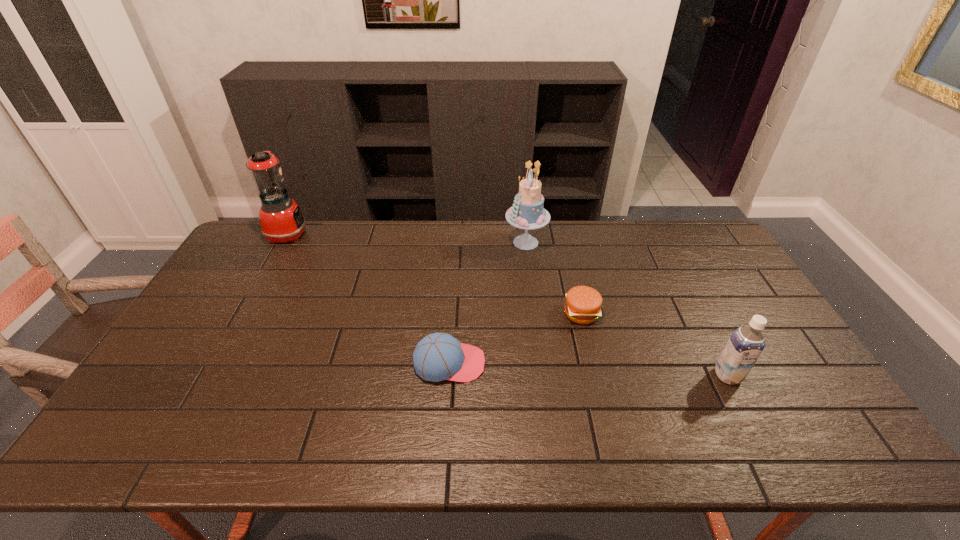
The height and width of the screenshot is (540, 960). Find the location of `blank space located with a ladder on the side of the cake`. blank space located with a ladder on the side of the cake is located at coordinates (401, 242).

Where is `free region located 0.150m with a ladder on the side of the cake`? free region located 0.150m with a ladder on the side of the cake is located at coordinates (463, 242).

You are a GUI agent. You are given a task and a screenshot of the screen. Output one action in this format:
    pyautogui.click(x=<x>, y=<y>)
    Task: Click on the blank space located 0.050m on the label of the soya milk
    
    Given the screenshot: What is the action you would take?
    pyautogui.click(x=742, y=402)

Find the location of a particular element. vacant area situated on the front-facing side of the second shortest object is located at coordinates (582, 363).

The image size is (960, 540). What are the coordinates of `free space located 0.060m on the right of the shortest object` in the screenshot? It's located at (618, 313).

This screenshot has width=960, height=540. Identify the location of food processor located in the far edge section of the desktop. (281, 219).

Find the location of a particular element. Image resolution: width=960 pixels, height=540 pixels. cake present at the far edge is located at coordinates (527, 212).

This screenshot has height=540, width=960. In order to click on object that is at the left edge in this screenshot , I will do `click(281, 219)`.

Locate an element on the screen. The image size is (960, 540). object present at the far left corner is located at coordinates (281, 219).

Find the location of a particular element. The height and width of the screenshot is (540, 960). free space at the far edge of the desktop is located at coordinates (540, 247).